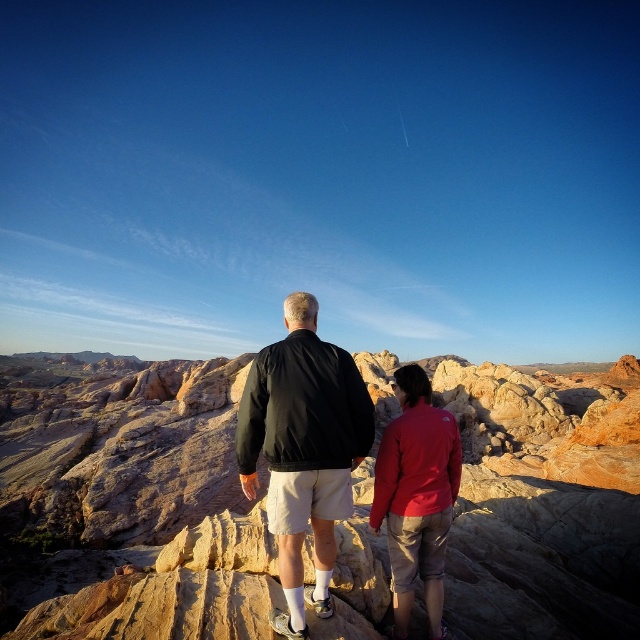
Who is shorter, black matte jacket at center or matte red jacket at center?

matte red jacket at center is shorter.

Does point (292, 532) come farther from viewer compared to point (397, 600)?

That is False.

Is point (360, 444) positioned behind point (451, 416)?

No.

This screenshot has height=640, width=640. I want to click on black matte jacket at center, so click(304, 449).